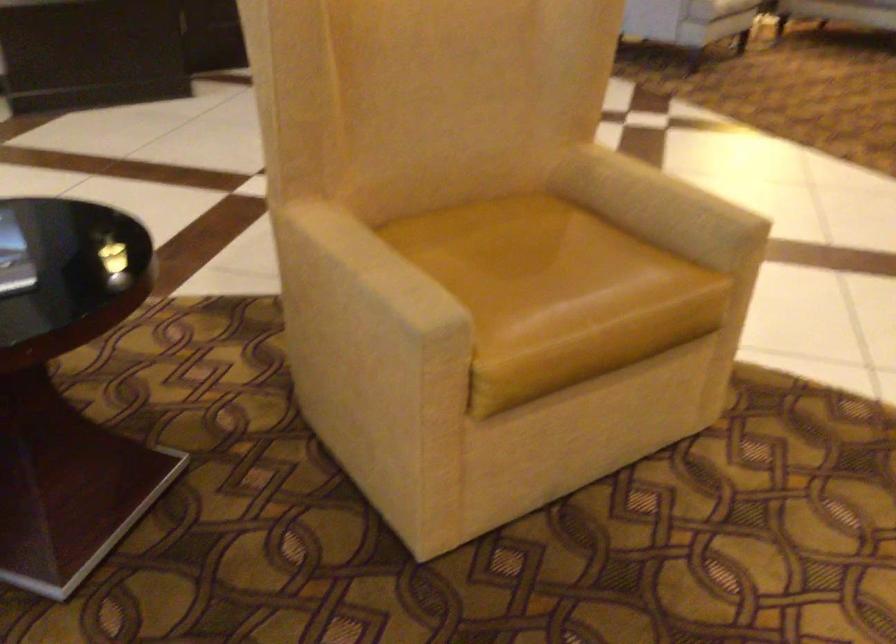
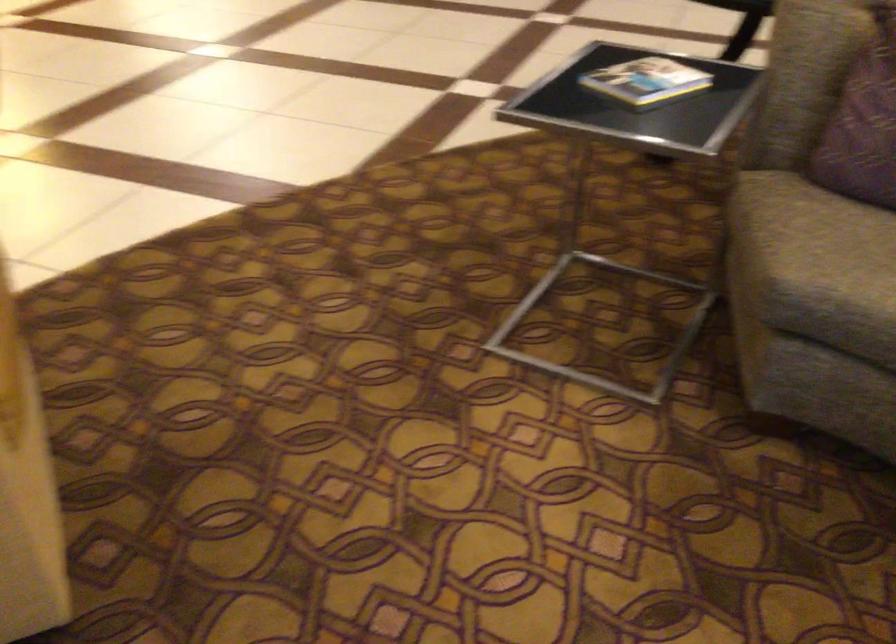
The first image is from the beginning of the video and the second image is from the end. How did the camera likely rotate when shooting the video?

The camera rotated toward right-down.